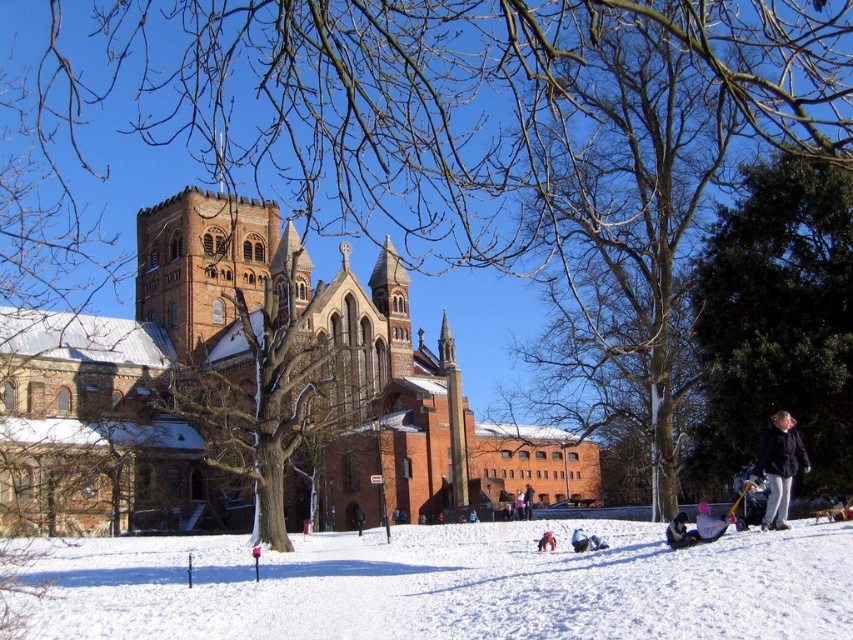
Which is in front, point (540, 429) or point (515, 602)?

Point (515, 602)

Between brown stone church at center and white fluffy snow at lower center, which one has more height?

Standing taller between the two is brown stone church at center.

Between point (210, 196) and point (801, 573), which one is positioned behind?

Positioned behind is point (210, 196).

Find the location of a particular element. brown stone church at center is located at coordinates (248, 388).

How distant is white fluffy snow at lower center from dark blue jacket at lower right?

white fluffy snow at lower center and dark blue jacket at lower right are 27.58 meters apart.

What do you see at coordinates (456, 586) in the screenshot? The height and width of the screenshot is (640, 853). I see `white fluffy snow at lower center` at bounding box center [456, 586].

Who is more forward, (608, 634) or (804, 448)?

Point (608, 634) is in front.

You are a GUI agent. You are given a task and a screenshot of the screen. Output one action in this format:
    pyautogui.click(x=<x>, y=<y>)
    Task: Click on the white fluffy snow at lower center
    Image resolution: width=853 pixels, height=640 pixels.
    Given the screenshot: What is the action you would take?
    pyautogui.click(x=456, y=586)

Does white fluffy snow at lower center lie in front of light pink fabric at lower center?

Yes, it is in front of light pink fabric at lower center.

Who is positioned more to the right, white fluffy snow at lower center or light pink fabric at lower center?

light pink fabric at lower center is more to the right.

The image size is (853, 640). In order to click on white fluffy snow at lower center in this screenshot , I will do `click(456, 586)`.

Identify the location of white fluffy snow at lower center. The width and height of the screenshot is (853, 640). click(x=456, y=586).